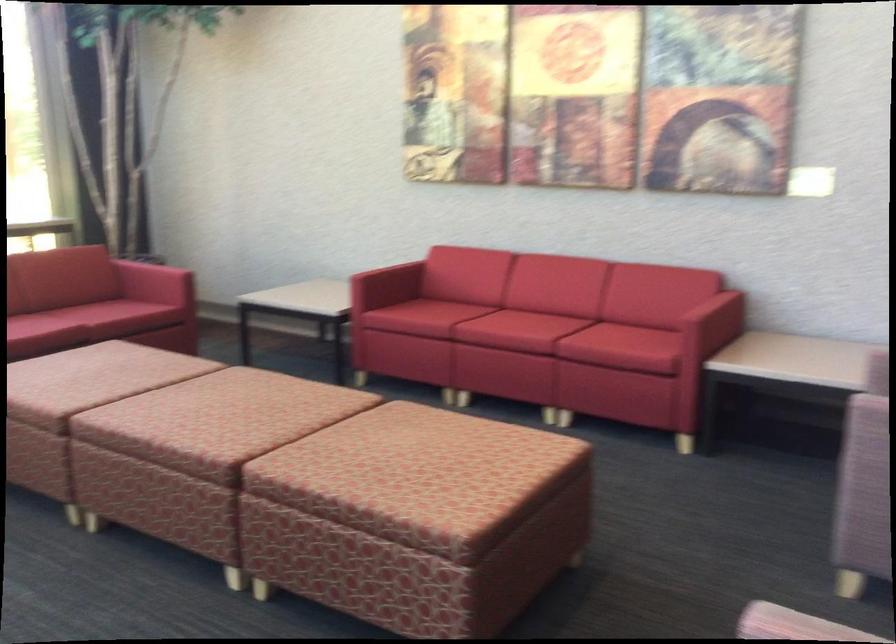
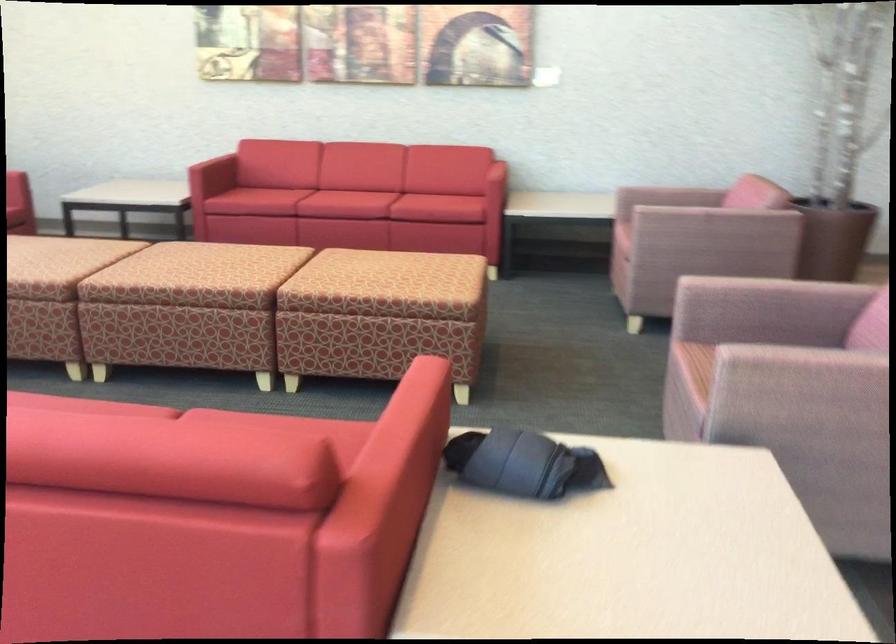
In the second image, find the point that corresponds to the point at 418,335 in the first image.

(265, 200)